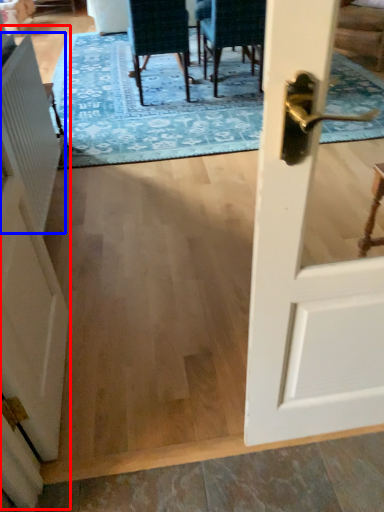
Question: Among these objects, which one is farthest to the camera, barn door (highlighted by a red box) or radiator (highlighted by a blue box)?

Choices:
 (A) barn door
 (B) radiator

Answer: (B)